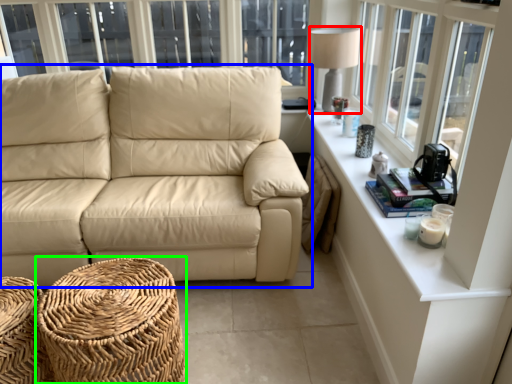
Question: Which object is the closest to the table lamp (highlighted by a red box)? Choose among these: studio couch (highlighted by a blue box) or footrest (highlighted by a green box).

Choices:
 (A) studio couch
 (B) footrest

Answer: (A)